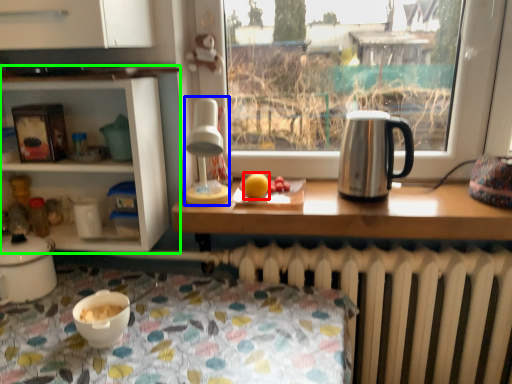
Question: Estimate the real-world distances between objects in this image. Which object is farther from orange (highlighted by a red box), lamp (highlighted by a blue box) or shelf (highlighted by a green box)?

Choices:
 (A) lamp
 (B) shelf

Answer: (B)